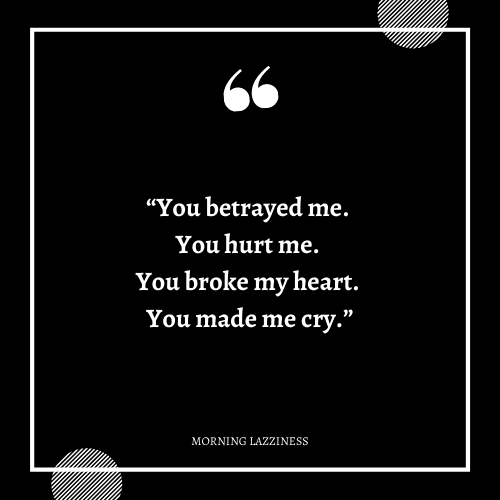
Locate an element on the screen. The width and height of the screenshot is (500, 500). corners is located at coordinates (466, 29), (34, 467), (469, 469), (29, 26).